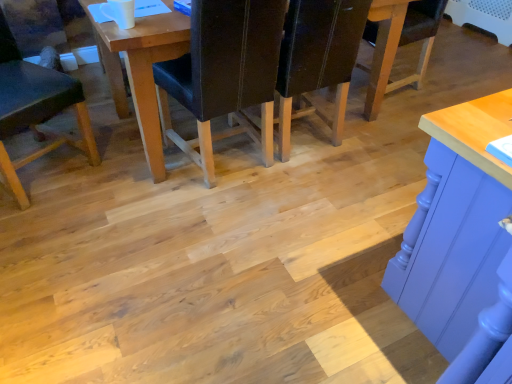
Question: Is matte black chair at lower left, the third chair in the right-to-left sequence, not close to wooden table at center?

Choices:
 (A) no
 (B) yes

Answer: (A)

Question: Is wooden table at center located within matte black chair at lower left, the third chair in the right-to-left sequence?

Choices:
 (A) yes
 (B) no

Answer: (B)

Question: Is the position of matte black chair at lower left, the third chair in the right-to-left sequence, less distant than that of wooden table at center?

Choices:
 (A) yes
 (B) no

Answer: (A)

Question: Is matte black chair at lower left, the first chair viewed from the left, positioned with its back to wooden table at center?

Choices:
 (A) yes
 (B) no

Answer: (B)

Question: Is matte black chair at lower left, the first chair viewed from the left, to the left of wooden table at center from the viewer's perspective?

Choices:
 (A) yes
 (B) no

Answer: (A)

Question: Is matte black chair at lower left, the third chair in the right-to-left sequence, directly adjacent to wooden table at center?

Choices:
 (A) yes
 (B) no

Answer: (B)

Question: Is wooden table at center located outside matte black chair at lower left, the third chair in the right-to-left sequence?

Choices:
 (A) no
 (B) yes

Answer: (B)

Question: Could you tell me if wooden table at center is turned towards matte black chair at lower left, the third chair in the right-to-left sequence?

Choices:
 (A) yes
 (B) no

Answer: (B)

Question: Does wooden table at center have a lesser width compared to matte black chair at lower left, the first chair viewed from the left?

Choices:
 (A) no
 (B) yes

Answer: (A)

Question: Is wooden table at center smaller than matte black chair at lower left, the third chair in the right-to-left sequence?

Choices:
 (A) yes
 (B) no

Answer: (B)

Question: Considering the relative sizes of wooden table at center and matte black chair at lower left, the third chair in the right-to-left sequence, in the image provided, is wooden table at center bigger than matte black chair at lower left, the third chair in the right-to-left sequence,?

Choices:
 (A) no
 (B) yes

Answer: (B)

Question: Does wooden table at center have a greater width compared to matte black chair at lower left, the first chair viewed from the left?

Choices:
 (A) yes
 (B) no

Answer: (A)

Question: Is dark brown leather chair at center, which appears as the third chair when viewed from the left, a part of wooden table at center?

Choices:
 (A) yes
 (B) no

Answer: (A)